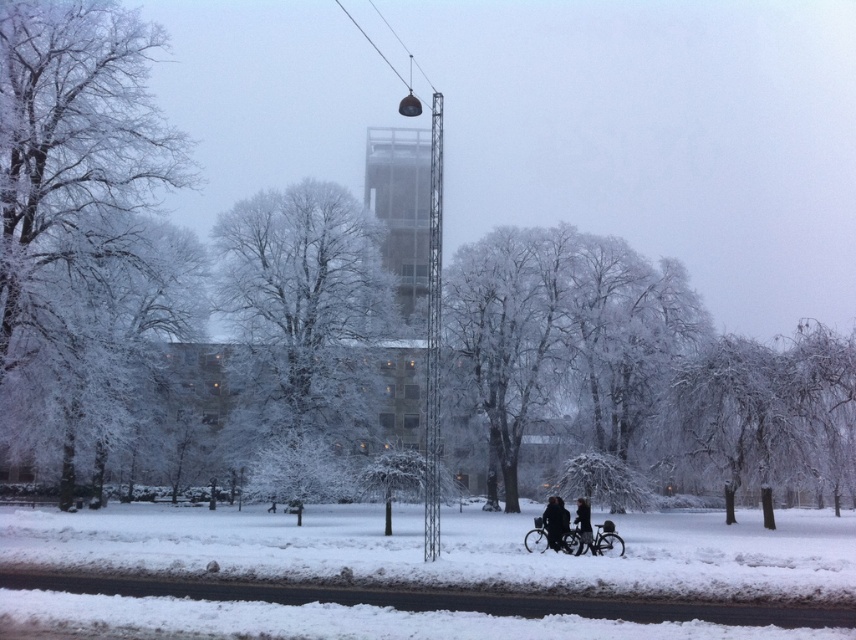
Question: Considering the real-world distances, which object is farthest from the dark gray jacket at lower center?

Choices:
 (A) dark gray fabric jacket at lower center
 (B) shiny metallic bicycle at lower center
 (C) dark matte coat at center
 (D) silver metallic bicycle at lower center

Answer: (B)

Question: Does dark matte coat at center appear over dark gray jacket at lower center?

Choices:
 (A) no
 (B) yes

Answer: (B)

Question: Which of these objects is positioned farthest from the dark matte coat at center?

Choices:
 (A) white fluffy snow at lower center
 (B) dark gray fabric jacket at lower center
 (C) shiny metallic bicycle at lower center
 (D) dark gray jacket at lower center

Answer: (A)

Question: In this image, where is white fluffy snow at lower center located relative to silver metallic bicycle at lower center?

Choices:
 (A) above
 (B) below

Answer: (B)

Question: Based on their relative distances, which object is nearer to the white fluffy snow at lower center?

Choices:
 (A) shiny metallic bicycle at lower center
 (B) silver metallic bicycle at lower center
 (C) dark gray jacket at lower center
 (D) dark matte coat at center

Answer: (D)

Question: Is white fluffy snow at lower center positioned behind dark matte coat at center?

Choices:
 (A) no
 (B) yes

Answer: (A)